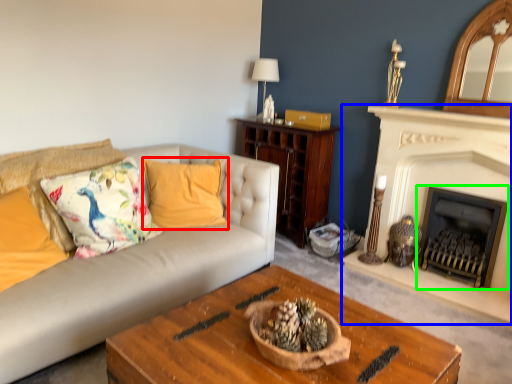
Question: Considering the real-world distances, which object is closest to pillow (highlighted by a red box)? fireplace (highlighted by a blue box) or fireplace (highlighted by a green box).

Choices:
 (A) fireplace
 (B) fireplace

Answer: (A)